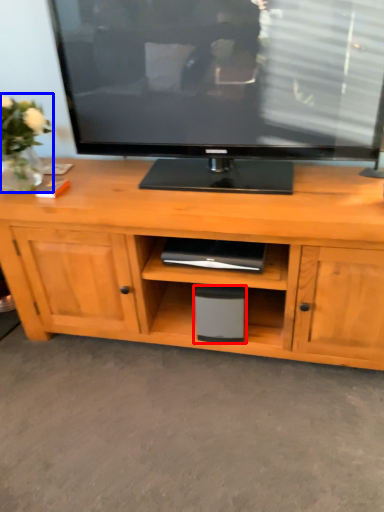
Question: Which object is closer to the camera taking this photo, speaker (highlighted by a red box) or plant (highlighted by a blue box)?

Choices:
 (A) speaker
 (B) plant

Answer: (B)